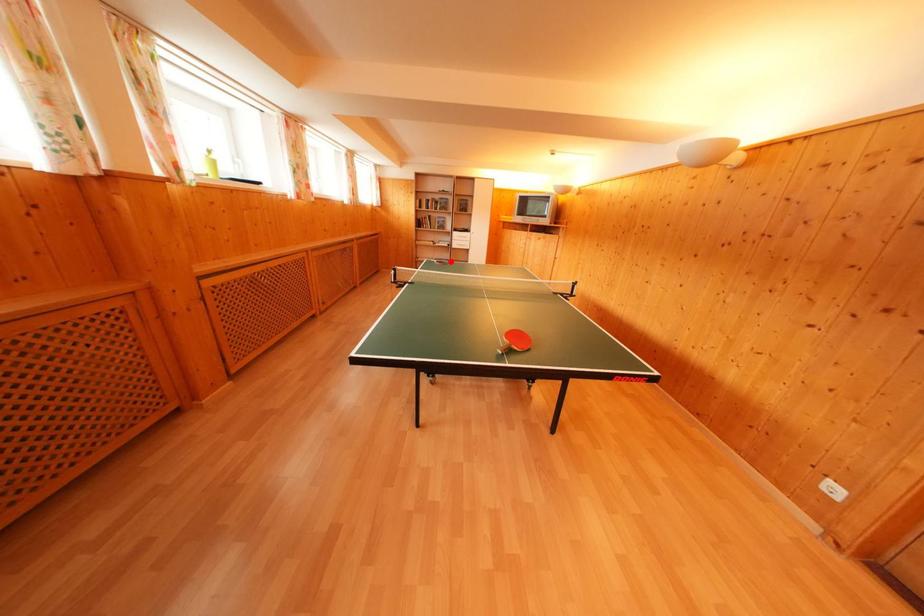
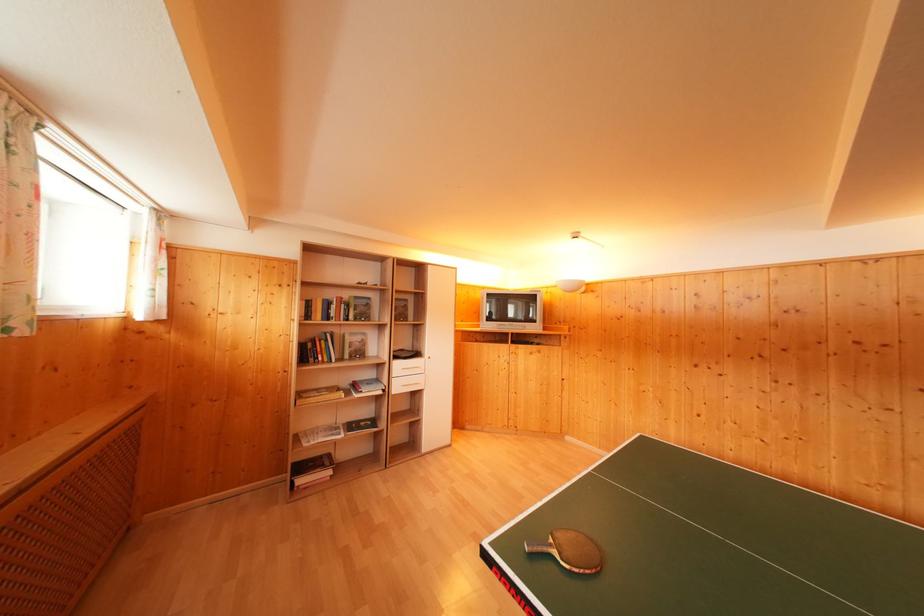
Find the pixel in the second image that matches the highlighted location in the first image.

(371, 416)